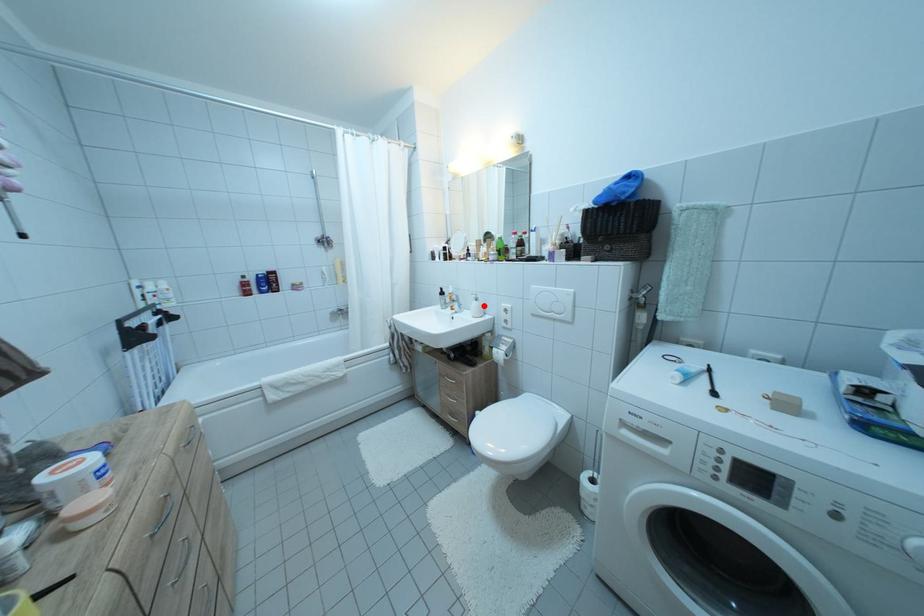
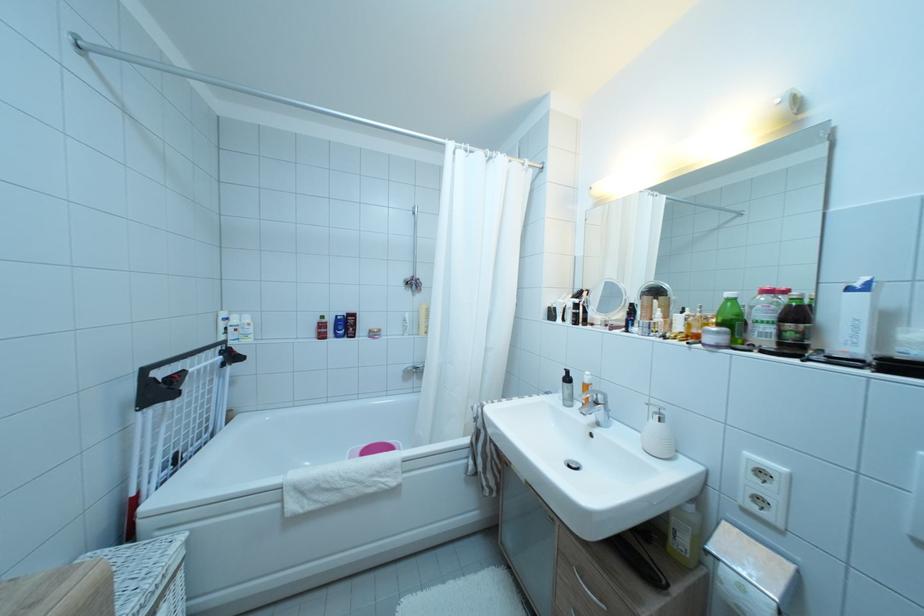
In the second image, find the point that corresponds to the highlighted location in the first image.

(667, 427)